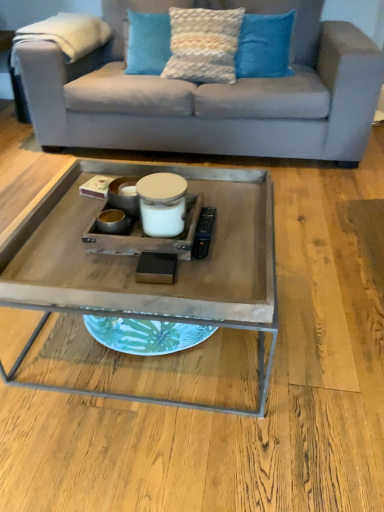
Question: Considering the positions of blue textured pillow at upper center, which ranks as the third pillow in left-to-right order, and wooden tray at center in the image, is blue textured pillow at upper center, which ranks as the third pillow in left-to-right order, wider or thinner than wooden tray at center?

Choices:
 (A) wide
 (B) thin

Answer: (B)

Question: In the image, is blue textured pillow at upper center, marked as the first pillow in a right-to-left arrangement, positioned in front of or behind wooden tray at center?

Choices:
 (A) front
 (B) behind

Answer: (B)

Question: Estimate the real-world distances between objects in this image. Which object is farther from the textured cream pillow at upper center, which is the second pillow from right to left?

Choices:
 (A) wooden tray at center
 (B) blue textured pillow at upper center, which ranks as the third pillow in left-to-right order
 (C) textured blue pillow at upper center, acting as the first pillow starting from the left
 (D) light gray fabric couch at upper center

Answer: (A)

Question: Based on their relative distances, which object is farther from the textured cream pillow at upper center, which is the second pillow from right to left?

Choices:
 (A) blue textured pillow at upper center, which ranks as the third pillow in left-to-right order
 (B) light gray fabric couch at upper center
 (C) wooden tray at center
 (D) textured blue pillow at upper center, acting as the first pillow starting from the left

Answer: (C)